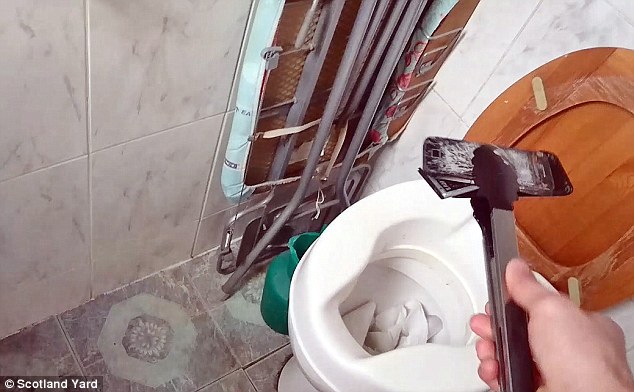
At what (x,y) coordinates should I click in order to perform the action: click on toilet. Please return your answer as a coordinate pair (x, y). Looking at the image, I should click on (311, 333).